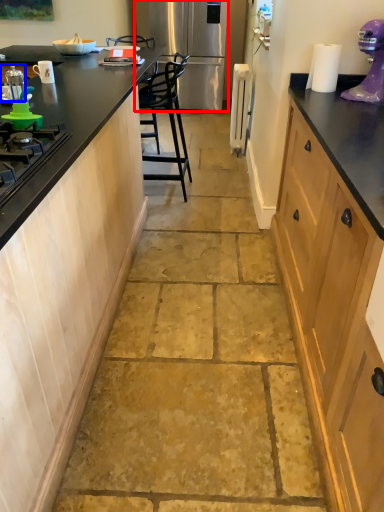
Question: Among these objects, which one is farthest to the camera, refrigerator (highlighted by a red box) or kitchen appliance (highlighted by a blue box)?

Choices:
 (A) refrigerator
 (B) kitchen appliance

Answer: (A)